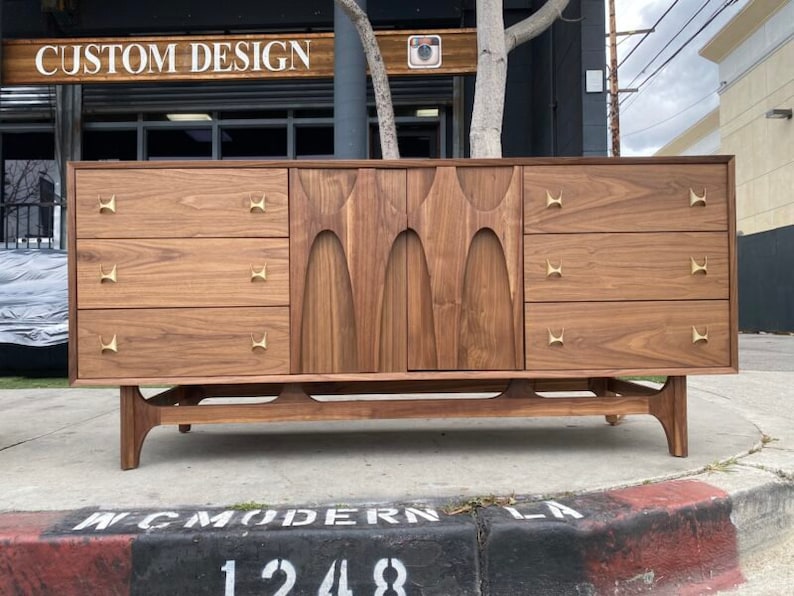
I want to click on base of dresser, so click(314, 409).